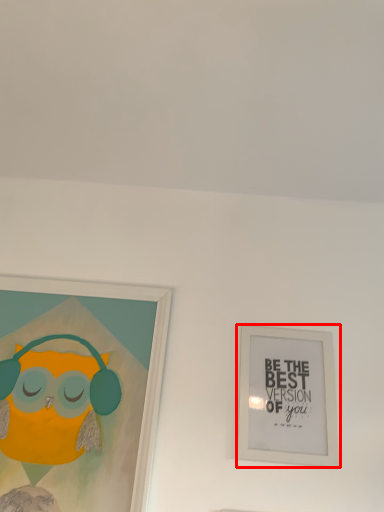
Question: In this image, where is picture frame (annotated by the red box) located relative to picture frame?

Choices:
 (A) right
 (B) left

Answer: (A)